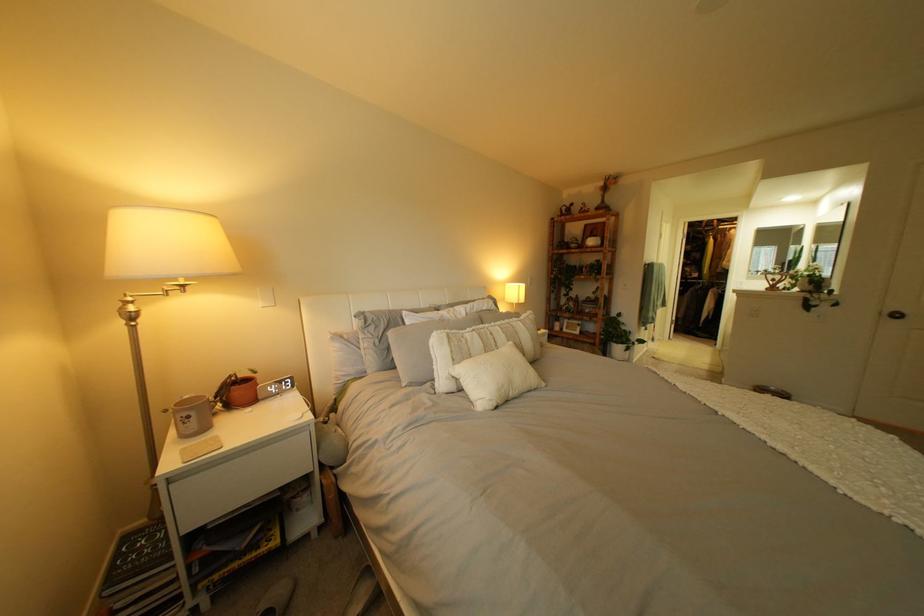
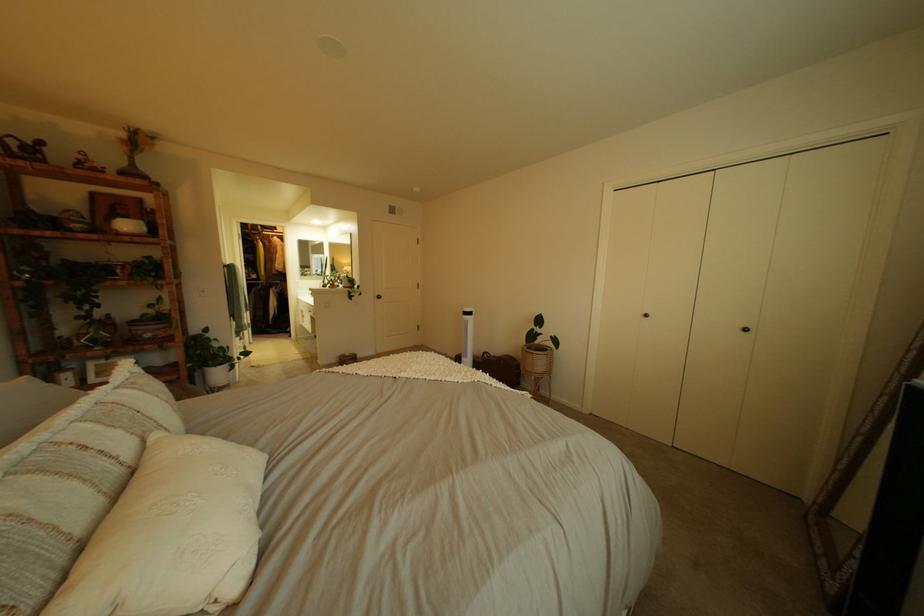
In the second image, find the point that corresponds to (609,342) in the first image.

(189, 379)